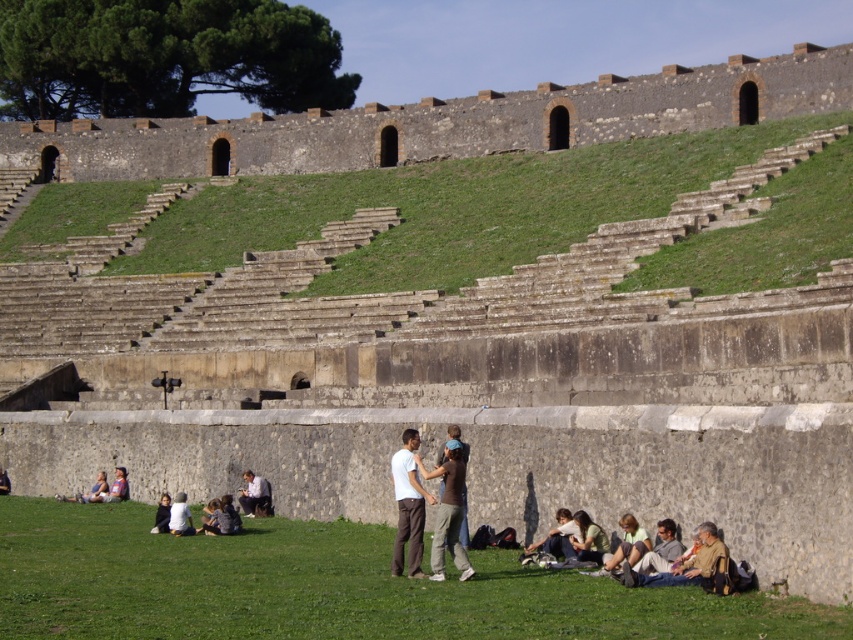
Consider the image. You are standing in the amphitheater and notice two items in the foreground. The brown leather jacket at lower right and the white fabric at lower left. Which item is positioned higher in the image?

The brown leather jacket at lower right is above the white fabric at lower left, so it is positioned higher in the image.